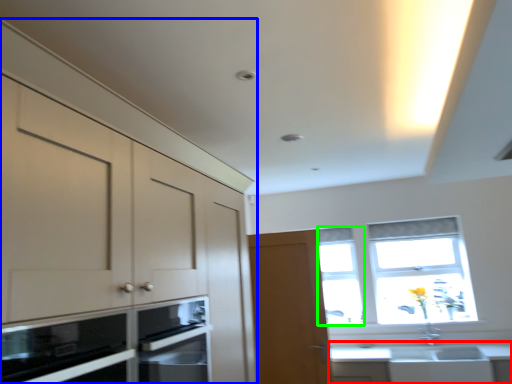
Question: Considering the real-world distances, which object is farthest from countertop (highlighted by a red box)? cabinetry (highlighted by a blue box) or window (highlighted by a green box)?

Choices:
 (A) cabinetry
 (B) window

Answer: (A)